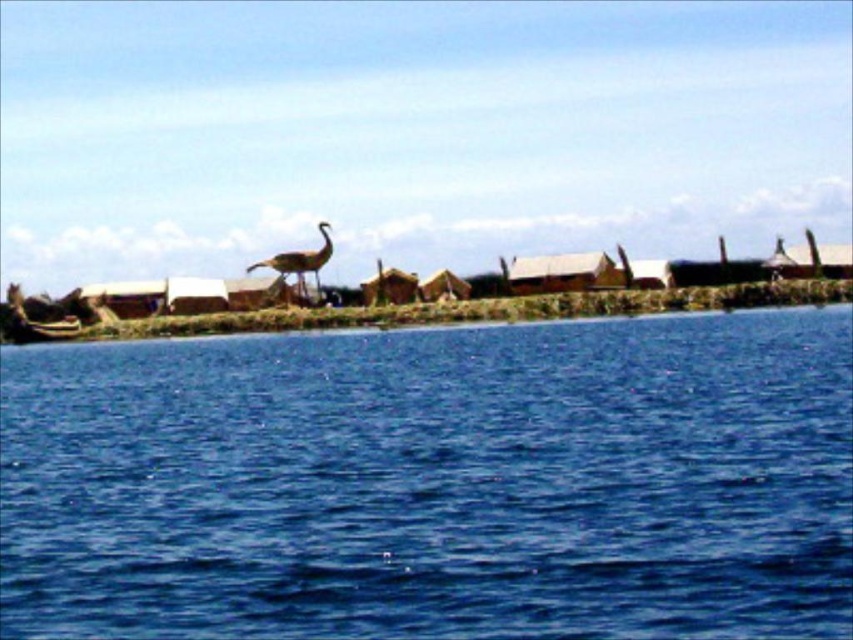
You are standing at the point marked by coordinates (434, 481) in the lakeside scene. Based on the image description, what would you most likely be standing on?

The point marked by coordinates (434, 481) corresponds to the blue water at center, so you would most likely be standing in the water.

You are an ornithologist observing a brown feathered bird at center and the blue water at center from a distance. Which object is closer to the surface of the water?

The brown feathered bird at center is closer to the surface of the water because it is positioned above the blue water at center.

You are standing at the lakeside and want to take a photo of both the blue water at center and the brown feathered bird at center. Which object should you focus on first to ensure both are in clear view?

You should focus on the blue water at center first since it is closer to the viewer than the brown feathered bird at center. By focusing on the closer object, the bird will also be in focus due to the depth of field.